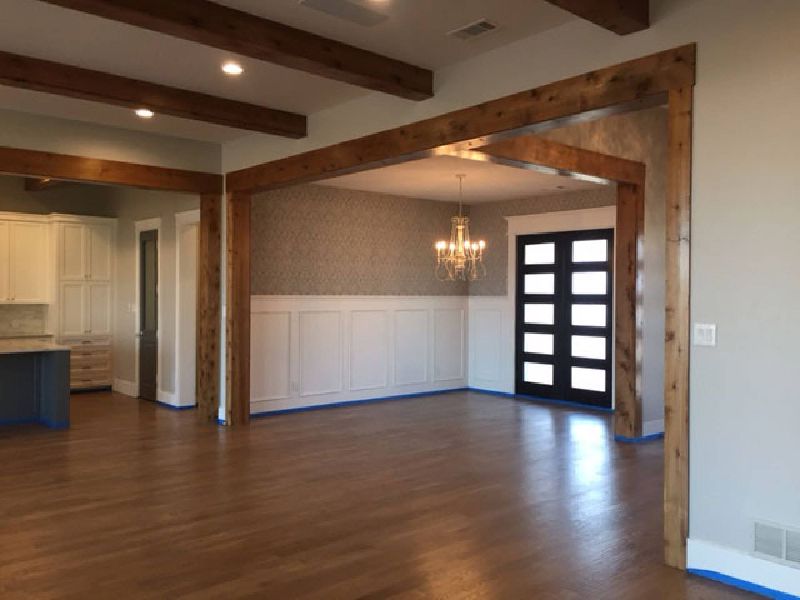
This screenshot has height=600, width=800. Identify the location of floor. (314, 561).